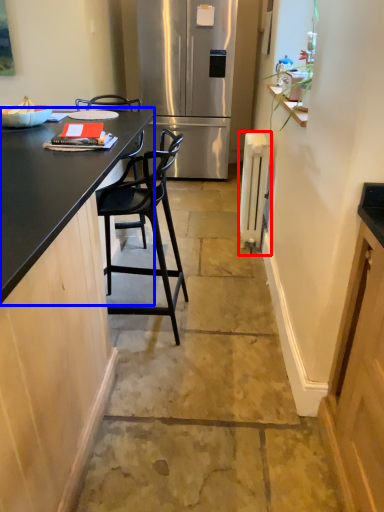
Question: Which point is closer to the camera, appliance (highlighted by a red box) or countertop (highlighted by a blue box)?

Choices:
 (A) appliance
 (B) countertop

Answer: (B)